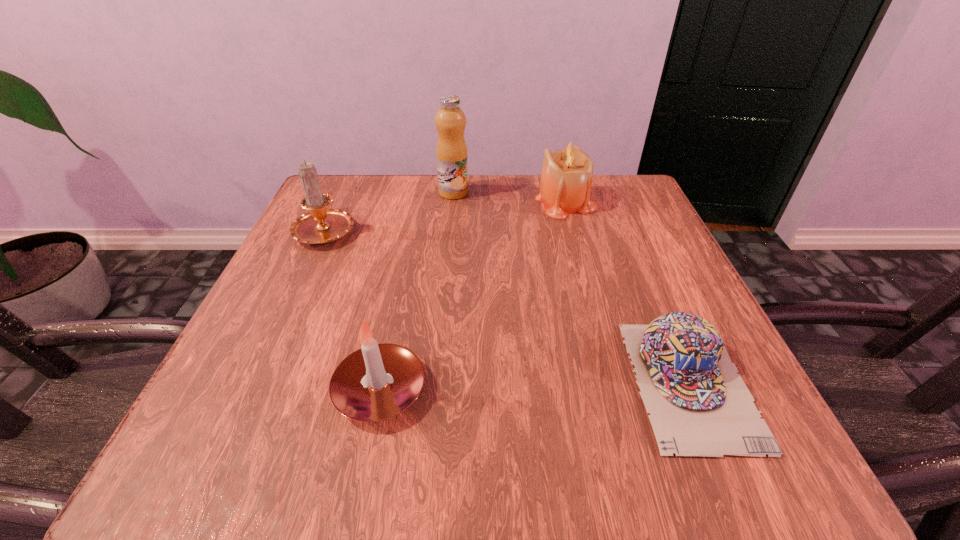
This screenshot has height=540, width=960. Find the location of `unoccupied position between the cap and the leftmost object`. unoccupied position between the cap and the leftmost object is located at coordinates (508, 306).

Where is `free point between the fruit juice and the leftmost candle`? free point between the fruit juice and the leftmost candle is located at coordinates (390, 211).

Image resolution: width=960 pixels, height=540 pixels. Identify the location of free point between the cap and the rightmost candle. (628, 292).

This screenshot has width=960, height=540. Identify the location of free space between the leftmost candle and the shortest object. (508, 306).

Where is `the third closest object to the rightmost candle`? the third closest object to the rightmost candle is located at coordinates (321, 225).

Identify which object is located as the nearest to the second candle from left to right. Please provide its 2D coordinates. Your answer should be formatted as a tuple, i.e. [(x, y)], where the tuple contains the x and y coordinates of a point satisfying the conditions above.

[(321, 225)]

Locate which candle ranks in proximity to the tallest object. Please provide its 2D coordinates. Your answer should be formatted as a tuple, i.e. [(x, y)], where the tuple contains the x and y coordinates of a point satisfying the conditions above.

[(566, 180)]

At what (x,y) coordinates should I click in order to perform the action: click on candle that stands as the closest to the rightmost candle. Please return your answer as a coordinate pair (x, y). This screenshot has height=540, width=960. Looking at the image, I should click on (321, 225).

Identify the location of vacant point that satisfies the following two spatial constraints: 1. on the front label of the tallest object; 2. on the back side of the rightmost candle. (453, 201).

Identify the location of vacant region that satisfies the following two spatial constraints: 1. on the back side of the rightmost candle; 2. on the front label of the fruit juice. (564, 193).